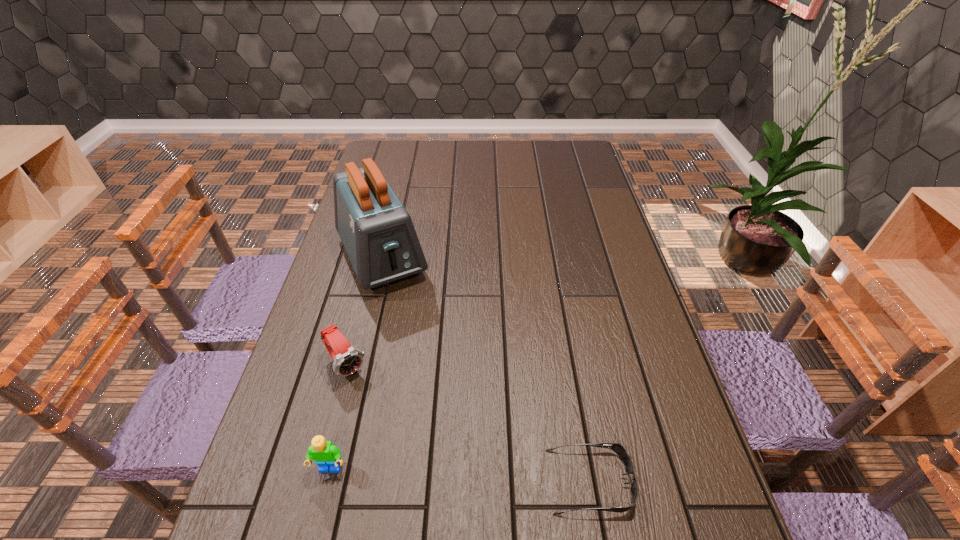
I want to click on free space on the desktop that is between the Lego and the sunglasses and is positioned on the face of the third nearest object, so click(426, 474).

Image resolution: width=960 pixels, height=540 pixels. I want to click on free space on the desktop that is between the Lego and the shortest object and is positioned on the front-facing side of the tallest object, so click(x=495, y=477).